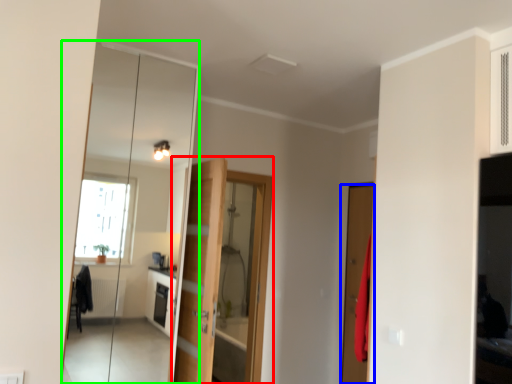
Question: Which is farther away from door (highlighted by a red box)? door (highlighted by a blue box) or mirror (highlighted by a green box)?

Choices:
 (A) door
 (B) mirror

Answer: (B)